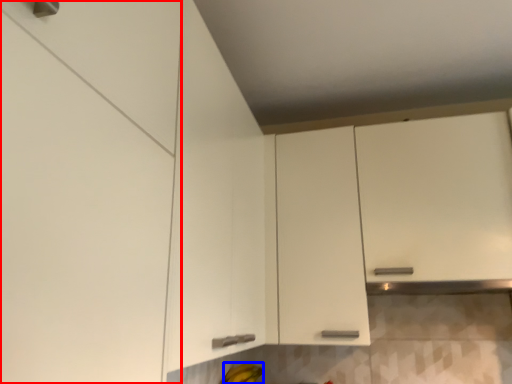
Question: Which point is closer to the camera, cabinetry (highlighted by a red box) or banana (highlighted by a blue box)?

Choices:
 (A) cabinetry
 (B) banana

Answer: (A)